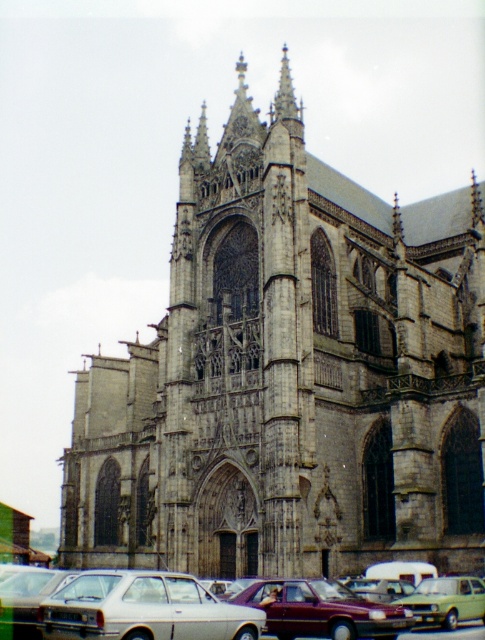
Question: Can you confirm if white matte car at lower left is positioned below white glossy sedan at lower center?

Choices:
 (A) yes
 (B) no

Answer: (B)

Question: Which point is closer to the camera taking this photo?

Choices:
 (A) (157, 637)
 (B) (276, 627)

Answer: (A)

Question: Which is farther from the white matte car at lower left?

Choices:
 (A) white glossy sedan at lower center
 (B) maroon metallic car at lower center

Answer: (B)

Question: Is white matte car at lower left positioned before green matte car at lower right?

Choices:
 (A) yes
 (B) no

Answer: (A)

Question: Does white matte car at lower left have a smaller size compared to maroon metallic car at lower center?

Choices:
 (A) no
 (B) yes

Answer: (A)

Question: Estimate the real-world distances between objects in this image. Which object is farther from the maroon metallic car at lower center?

Choices:
 (A) white matte car at lower left
 (B) green matte car at lower right

Answer: (B)